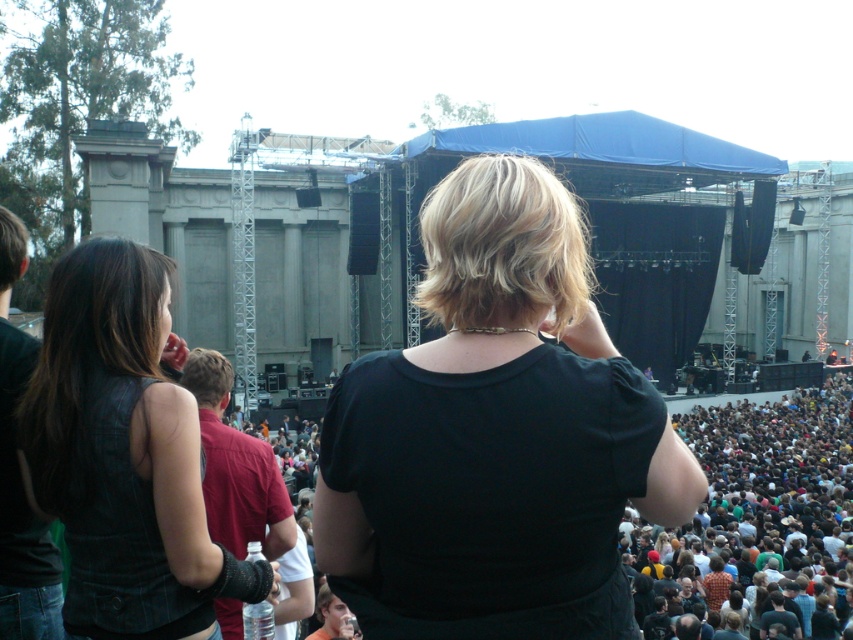
Who is more forward, (x=553, y=323) or (x=727, y=540)?

Point (x=553, y=323) is in front.

The width and height of the screenshot is (853, 640). I want to click on black matte shirt at center, so click(x=495, y=435).

Between point (679, 512) and point (769, 529), which one is positioned behind?

The point (769, 529) is behind.

Find the location of a particular element. Image resolution: width=853 pixels, height=640 pixels. black matte shirt at center is located at coordinates (495, 435).

Does leather vest at left appear under dark brown hair at lower right?

Actually, leather vest at left is above dark brown hair at lower right.

Between leather vest at left and dark brown hair at lower right, which one appears on the left side from the viewer's perspective?

Positioned to the left is leather vest at left.

At what (x,y) coordinates should I click in order to perform the action: click on leather vest at left. Please return your answer as a coordinate pair (x, y). Looking at the image, I should click on (125, 452).

Which is behind, point (456, 557) or point (164, 380)?

Positioned behind is point (164, 380).

Who is taller, black matte shirt at center or leather vest at left?

black matte shirt at center is taller.

Find the location of a particular element. black matte shirt at center is located at coordinates (495, 435).